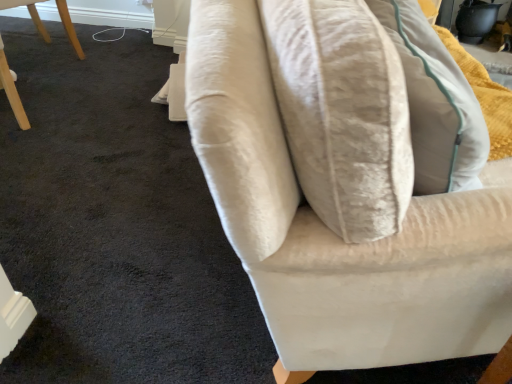
Question: Visually, is velvet beige sofa at center positioned to the left or to the right of matte wood chair at lower left?

Choices:
 (A) left
 (B) right

Answer: (B)

Question: From a real-world perspective, is velvet beige sofa at center above or below matte wood chair at lower left?

Choices:
 (A) below
 (B) above

Answer: (A)

Question: In terms of size, does velvet beige sofa at center appear bigger or smaller than matte wood chair at lower left?

Choices:
 (A) big
 (B) small

Answer: (A)

Question: Considering the positions of matte wood chair at lower left and velvet beige sofa at center in the image, is matte wood chair at lower left bigger or smaller than velvet beige sofa at center?

Choices:
 (A) small
 (B) big

Answer: (A)

Question: Which is correct: matte wood chair at lower left is inside velvet beige sofa at center, or outside of it?

Choices:
 (A) outside
 (B) inside

Answer: (A)

Question: Is matte wood chair at lower left wider or thinner than velvet beige sofa at center?

Choices:
 (A) thin
 (B) wide

Answer: (A)

Question: From the image's perspective, is matte wood chair at lower left located above or below velvet beige sofa at center?

Choices:
 (A) below
 (B) above

Answer: (B)